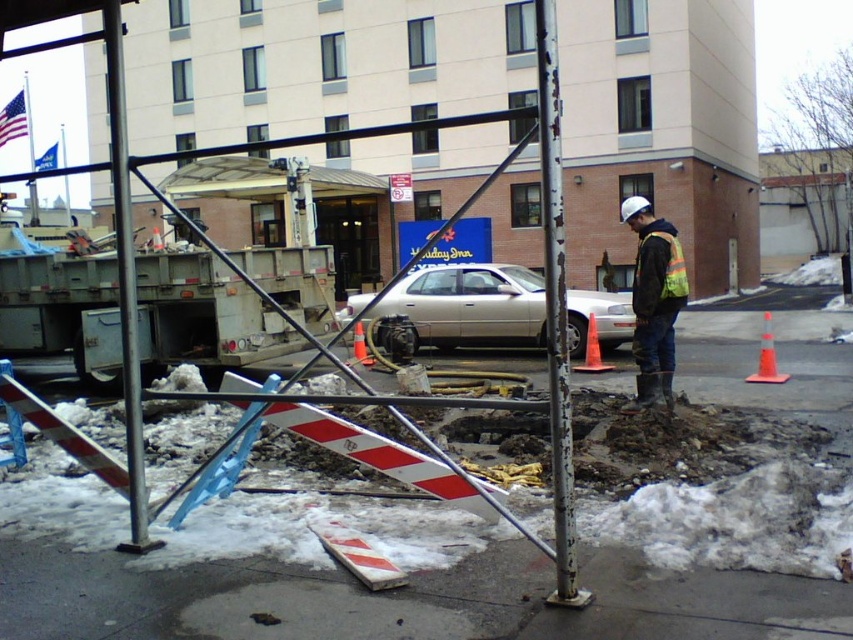
Is silver metallic sedan at center smaller than reflective yellow-green safety vest at center?

No.

Does point (456, 314) lie in front of point (665, 312)?

No, (456, 314) is further to viewer.

Between point (463, 328) and point (642, 371), which one is positioned behind?

Point (463, 328)

At what (x,y) coordinates should I click in order to perform the action: click on silver metallic sedan at center. Please return your answer as a coordinate pair (x, y). Image resolution: width=853 pixels, height=640 pixels. Looking at the image, I should click on (469, 305).

Can you confirm if silver metallic sedan at center is taller than reflective yellow-green safety vest at center-right?

Indeed, silver metallic sedan at center has a greater height compared to reflective yellow-green safety vest at center-right.

Is point (512, 269) farther from viewer compared to point (670, 250)?

Yes, it is behind point (670, 250).

Is point (473, 317) farther from viewer compared to point (677, 285)?

Yes, it is.

The height and width of the screenshot is (640, 853). In order to click on silver metallic sedan at center in this screenshot , I will do `click(469, 305)`.

Is point (619, 216) farther from viewer compared to point (677, 266)?

Yes.

Between reflective yellow-green safety vest at center and reflective yellow-green safety vest at center-right, which one has more height?

reflective yellow-green safety vest at center is taller.

This screenshot has width=853, height=640. Identify the location of reflective yellow-green safety vest at center. (654, 300).